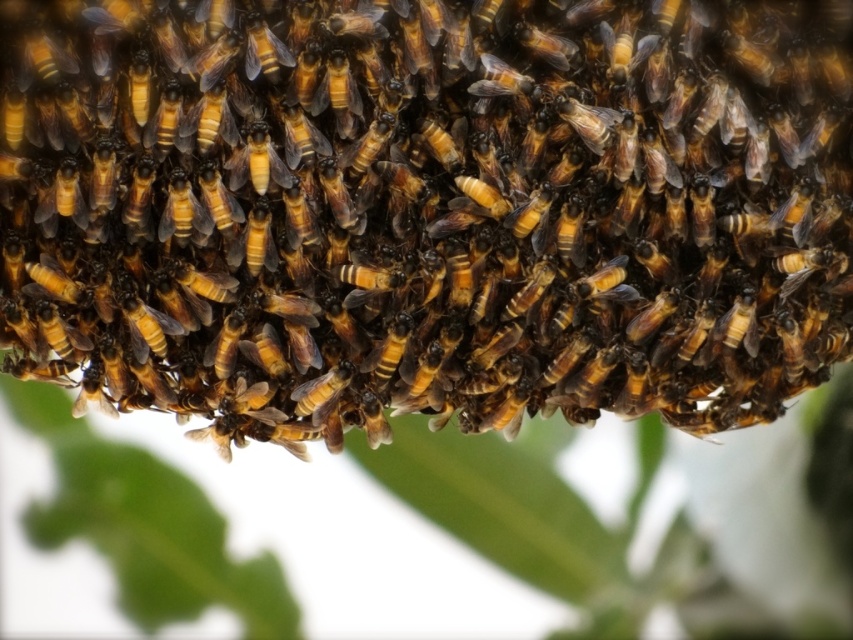
Question: Among these objects, which one is farthest from the camera?

Choices:
 (A) brown fuzzy beehive at center
 (B) brown fuzzy bee at center

Answer: (B)

Question: Can you confirm if shiny golden bee at center is positioned above brown fuzzy bee at center?

Choices:
 (A) yes
 (B) no

Answer: (A)

Question: Can you confirm if brown fuzzy beehive at center is positioned below shiny golden bee at center?

Choices:
 (A) no
 (B) yes

Answer: (B)

Question: Which point appears farthest from the camera in this image?

Choices:
 (A) (165, 208)
 (B) (305, 396)

Answer: (B)

Question: Considering the real-world distances, which object is farthest from the shiny golden bee at center?

Choices:
 (A) brown fuzzy bee at center
 (B) brown fuzzy beehive at center

Answer: (B)

Question: Is the position of shiny golden bee at center more distant than that of brown fuzzy bee at center?

Choices:
 (A) yes
 (B) no

Answer: (B)